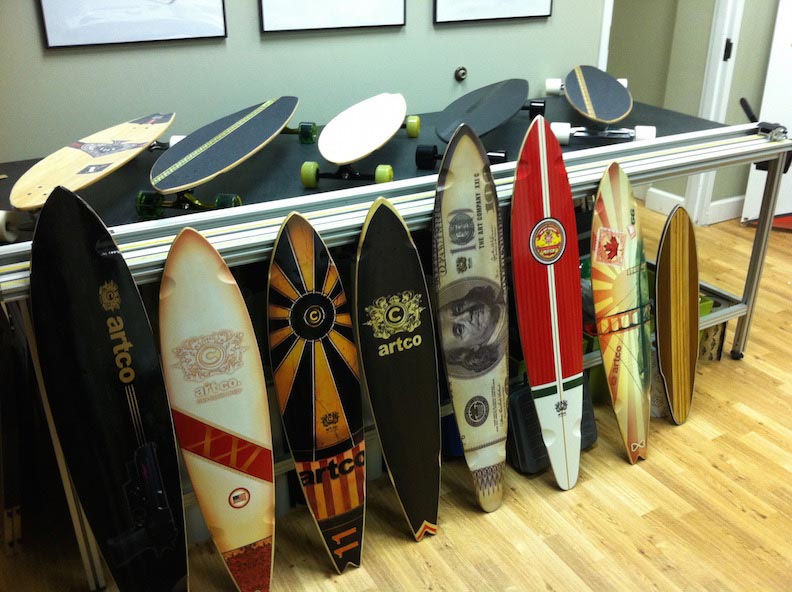
What are the coordinates of `door stopper` in the screenshot? It's located at (465, 77).